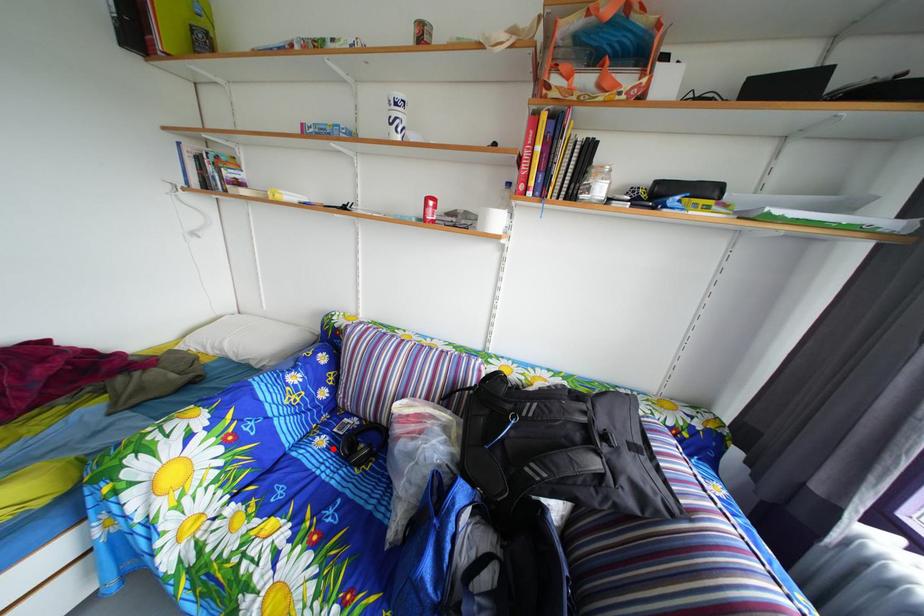
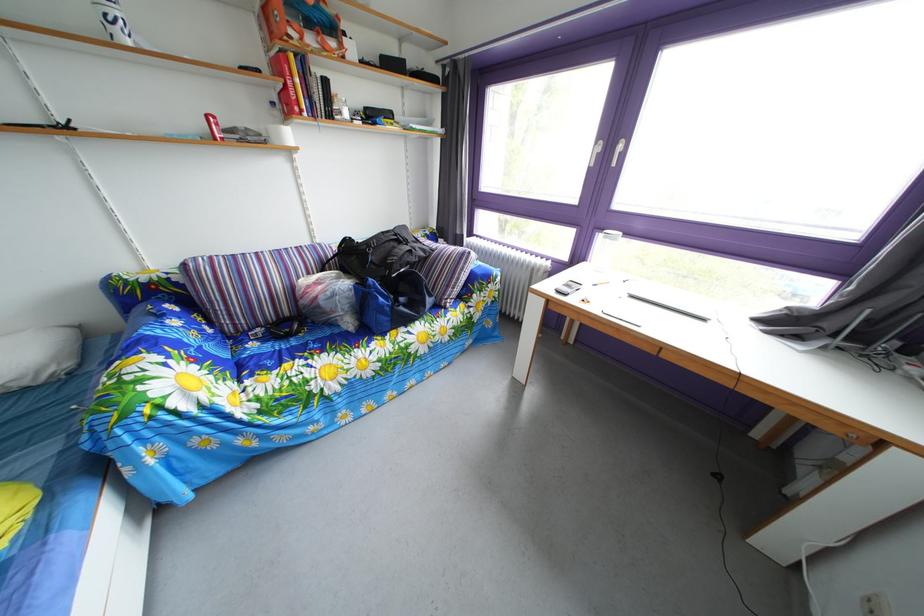
In the second image, find the point that corresponds to the highlighted location in the first image.

(262, 353)